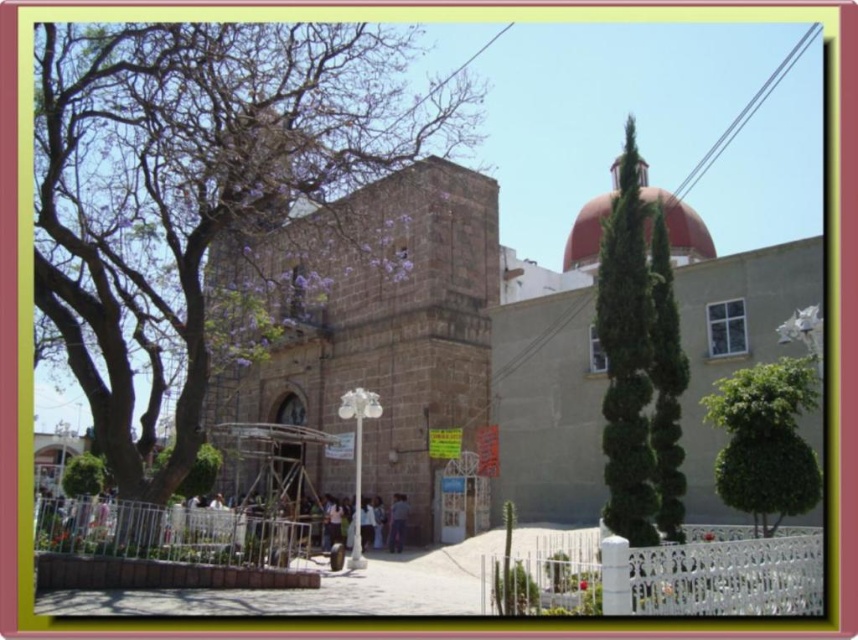
You are standing in a park and want to take a photo of the brown stone church at center. The camera you are using has a maximum focus range of 50 meters. Will you be able to capture the church in focus without moving closer?

The brown stone church at center is 47.34 meters away from the camera. Since the camera can focus up to 50 meters, you can capture the church in focus without moving closer.